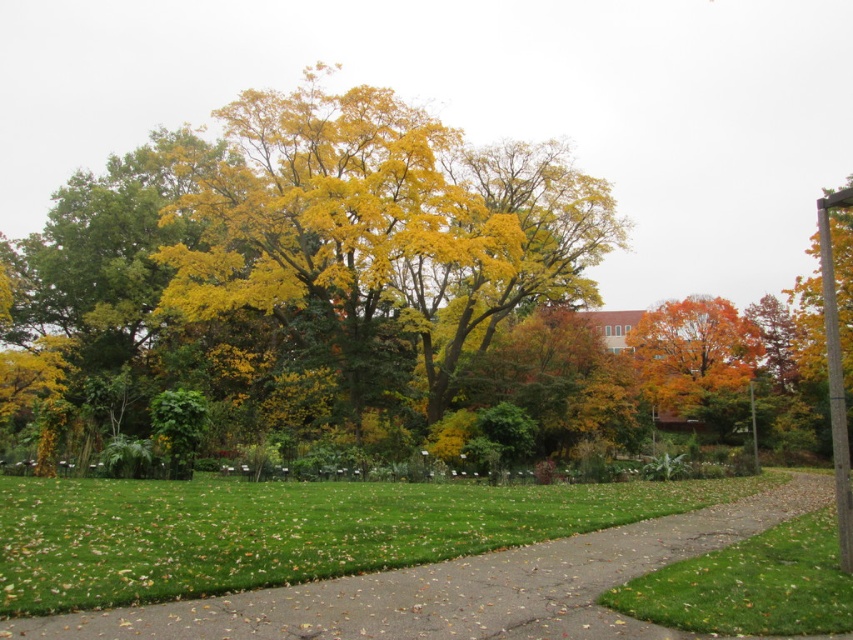
You are standing at the camera position looking at the scene. There are two points marked in the image, one at coordinates point (564, 208) and another at point (761, 612). Which point is closer to you?

Point (761, 612) is closer to you because it is less further to the camera than point (564, 208).

You are planning to place a picnic blanket in the scene. Given the green concrete pavement at center and the green grass at lower right, which surface would allow the blanket to cover more area without overlapping? Please choose between the two surfaces.

The green concrete pavement at center is larger in size than the green grass at lower right, so placing the picnic blanket on the green concrete pavement at center would allow it to cover more area without overlapping.

You are standing at the point marked by the coordinate (459,588) in the image. What object are you currently standing on?

You are standing on the green concrete pavement at center.